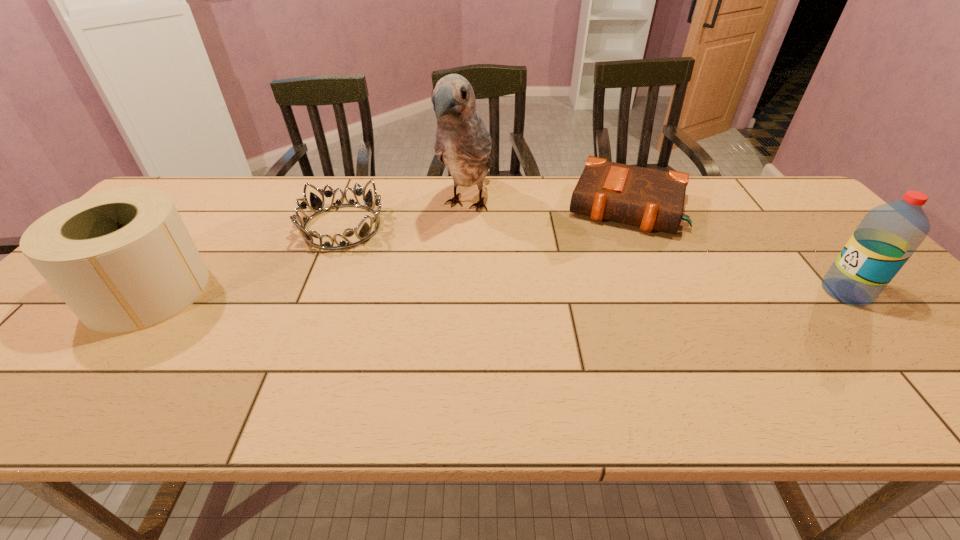
Select which object appears as the second closest to the parrot. Please provide its 2D coordinates. Your answer should be formatted as a tuple, i.e. [(x, y)], where the tuple contains the x and y coordinates of a point satisfying the conditions above.

[(651, 199)]

Locate which object ranks third in proximity to the tiara. Please provide its 2D coordinates. Your answer should be formatted as a tuple, i.e. [(x, y)], where the tuple contains the x and y coordinates of a point satisfying the conditions above.

[(651, 199)]

The width and height of the screenshot is (960, 540). I want to click on vacant space that satisfies the following two spatial constraints: 1. on the back side of the third shortest object; 2. on the left side of the second object from left to right, so click(200, 227).

Image resolution: width=960 pixels, height=540 pixels. I want to click on vacant space that satisfies the following two spatial constraints: 1. on the front side of the fourth object from right to left; 2. on the front label of the fourth shortest object, so click(316, 292).

The height and width of the screenshot is (540, 960). In order to click on vacant position in the image that satisfies the following two spatial constraints: 1. on the front side of the Bible; 2. on the left side of the tallest object in this screenshot , I will do `click(467, 206)`.